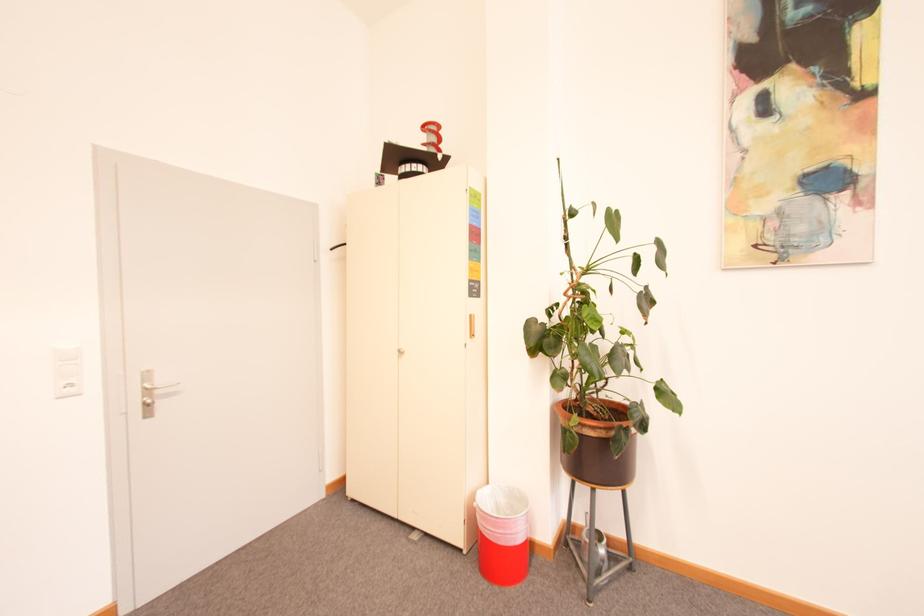
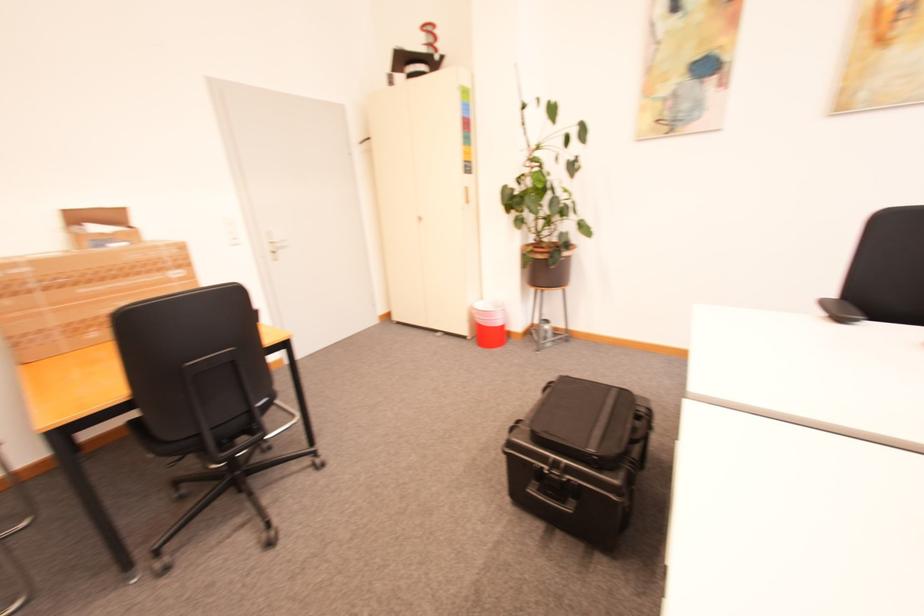
In the second image, find the point that corresponds to [470,553] in the first image.

(476, 339)